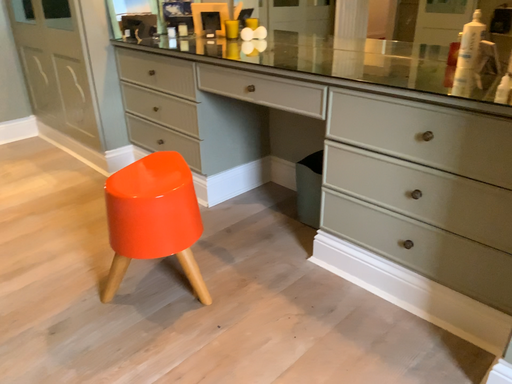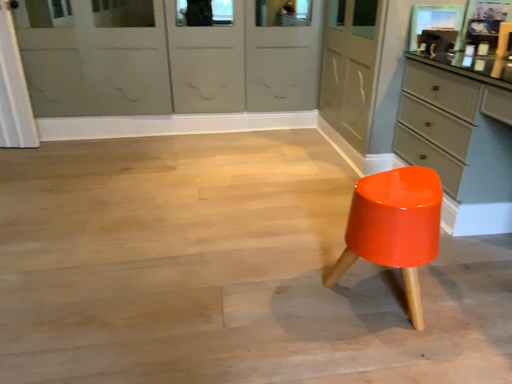
Question: Which way did the camera rotate in the video?

Choices:
 (A) rotated downward
 (B) rotated upward

Answer: (B)